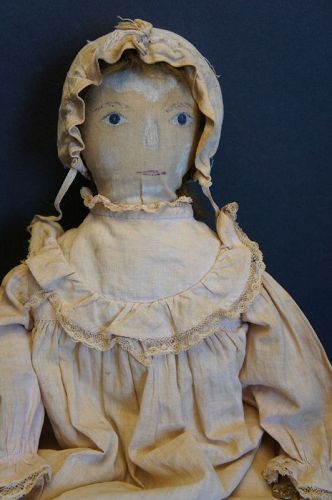
The image size is (332, 500). Find the location of `lace`. lace is located at coordinates (199, 332).